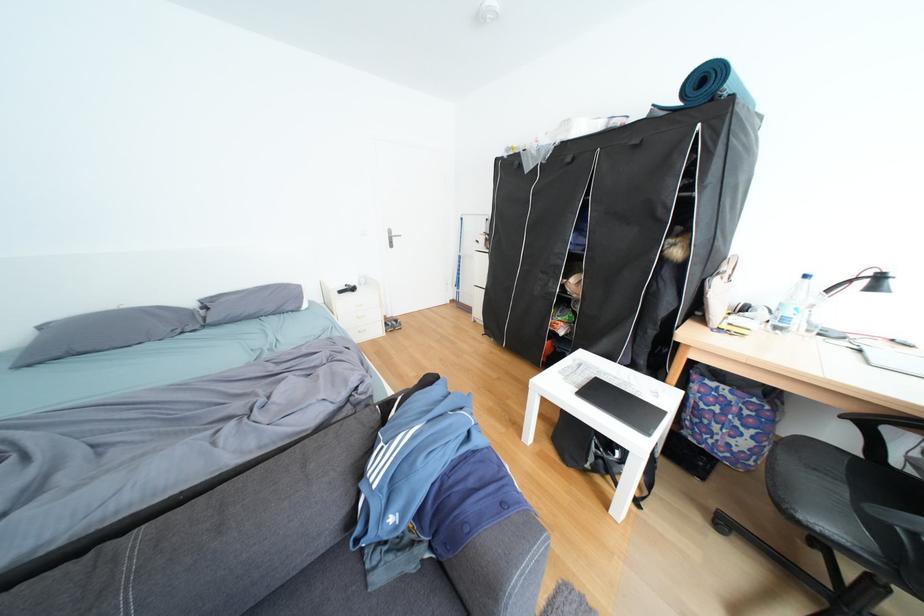
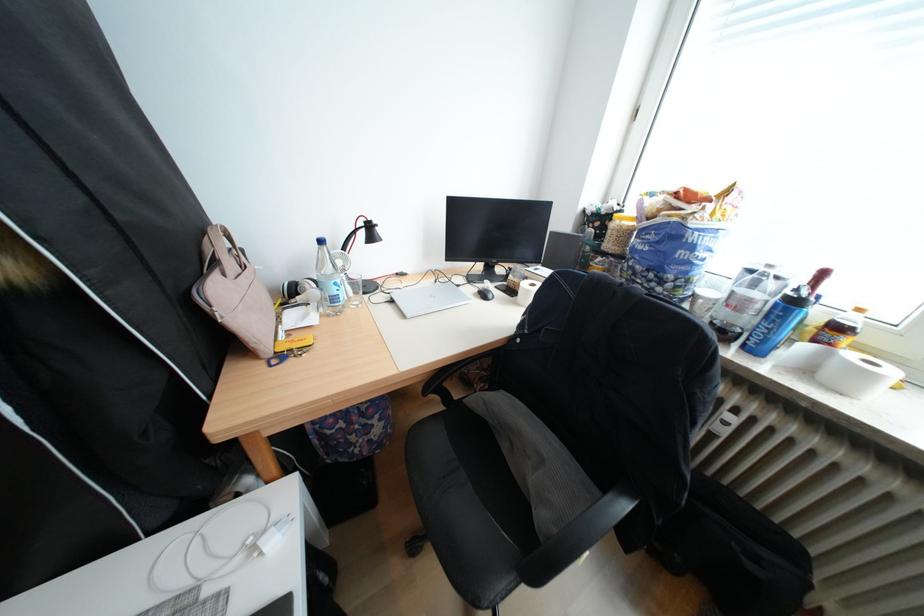
The point at (870,351) is marked in the first image. Where is the corresponding point in the second image?

(405, 302)